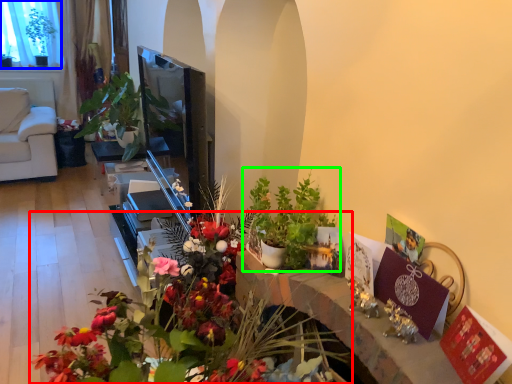
Question: Based on their relative distances, which object is farther from flower (highlighted by a red box)? Choose from window screen (highlighted by a blue box) and houseplant (highlighted by a green box).

Choices:
 (A) window screen
 (B) houseplant

Answer: (A)